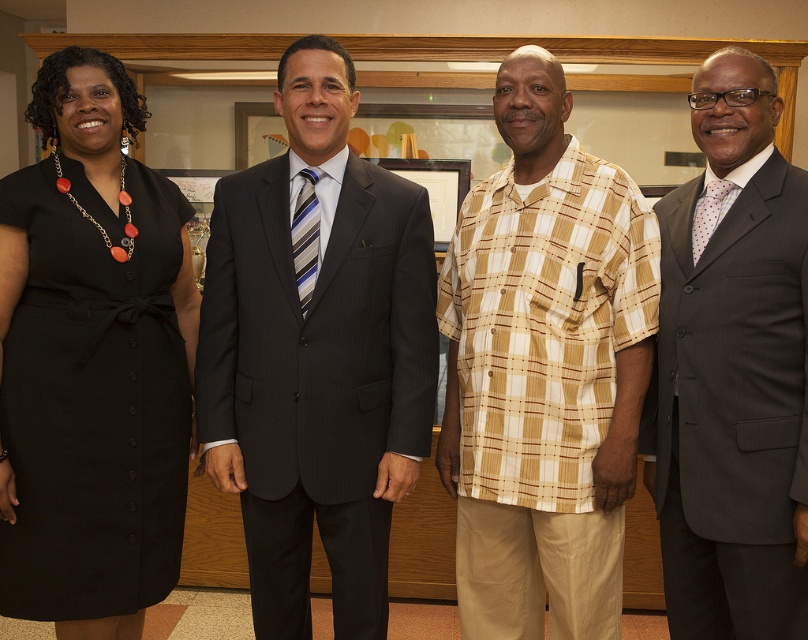
Question: Does dark gray pinstripe suit at center have a lesser width compared to black fabric dress at left?

Choices:
 (A) yes
 (B) no

Answer: (B)

Question: Which object appears farthest from the camera in this image?

Choices:
 (A) black fabric dress at left
 (B) striped silk tie at center
 (C) dark gray pinstripe suit at center

Answer: (B)

Question: Can you confirm if beige plaid shirt at center is bigger than striped silk tie at center?

Choices:
 (A) no
 (B) yes

Answer: (B)

Question: Which of these objects is positioned closest to the dark gray pinstripe suit at center?

Choices:
 (A) beige plaid shirt at center
 (B) gray suit at right

Answer: (A)

Question: Which point appears farthest from the camera in this image?

Choices:
 (A) (87, 524)
 (B) (790, 273)

Answer: (A)

Question: Is black fabric dress at left further to camera compared to polka dot silk tie at right?

Choices:
 (A) no
 (B) yes

Answer: (A)